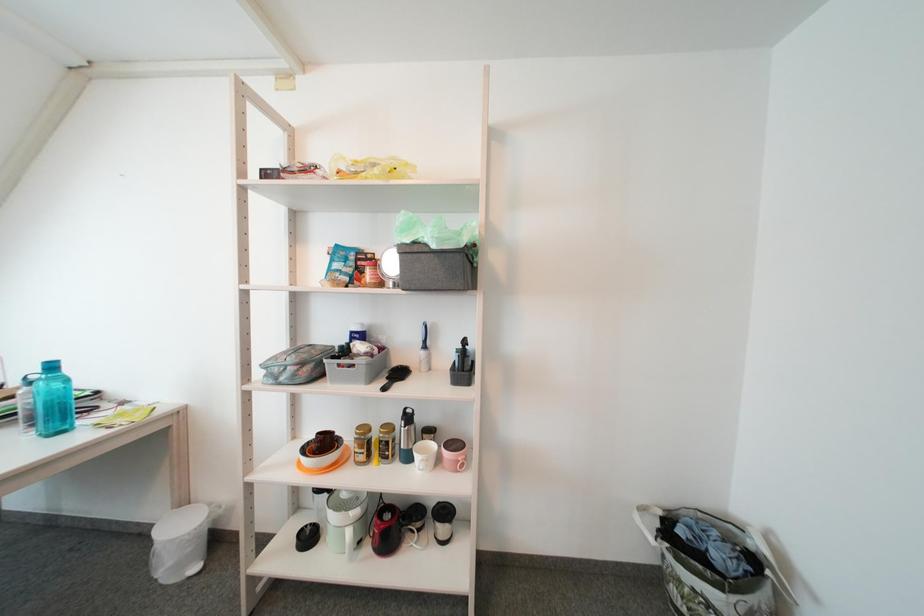
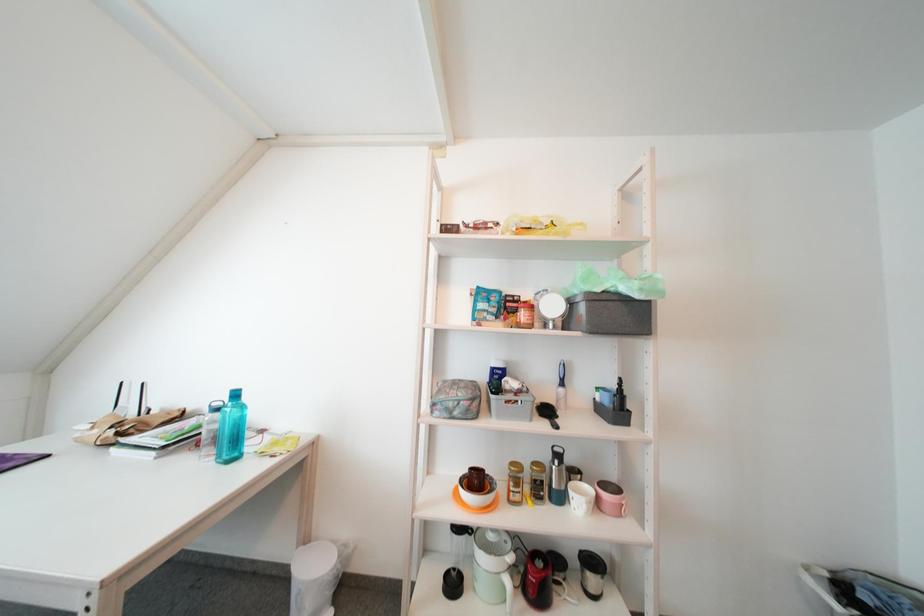
Question: The images are taken continuously from a first-person perspective. In which direction are you moving?

Choices:
 (A) Left
 (B) Right
 (C) Forward
 (D) Backward

Answer: (A)